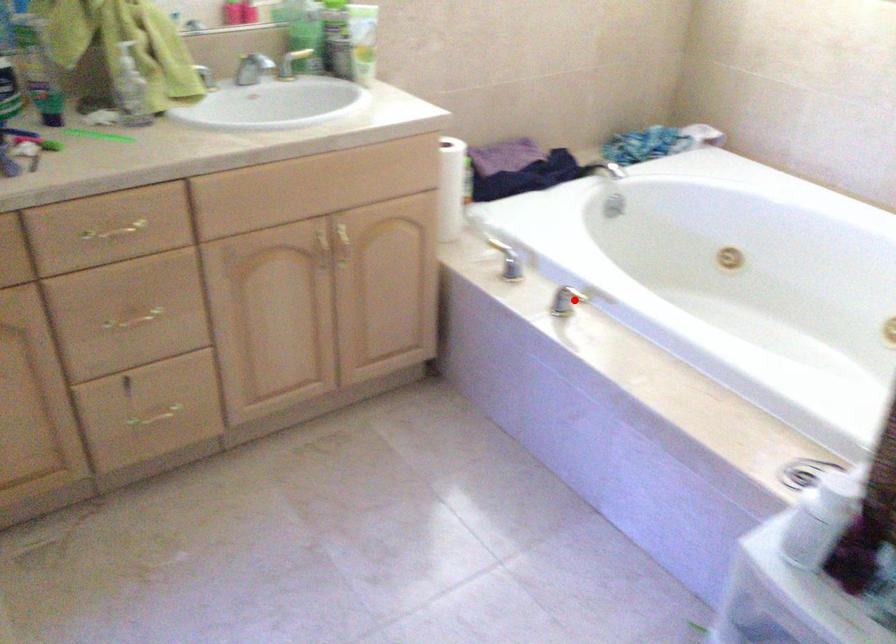
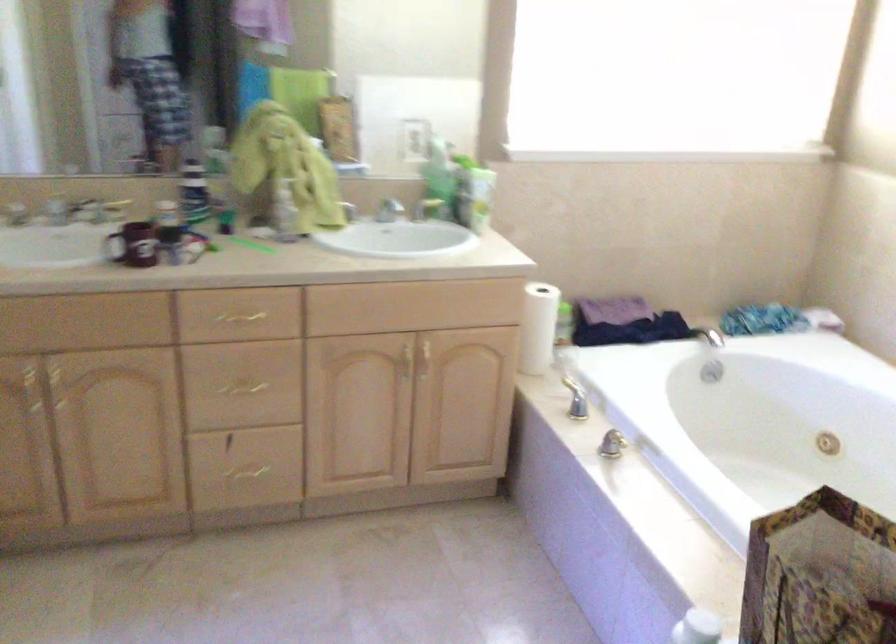
Where in the second image is the point corresponding to the highlighted location from the first image?

(625, 442)